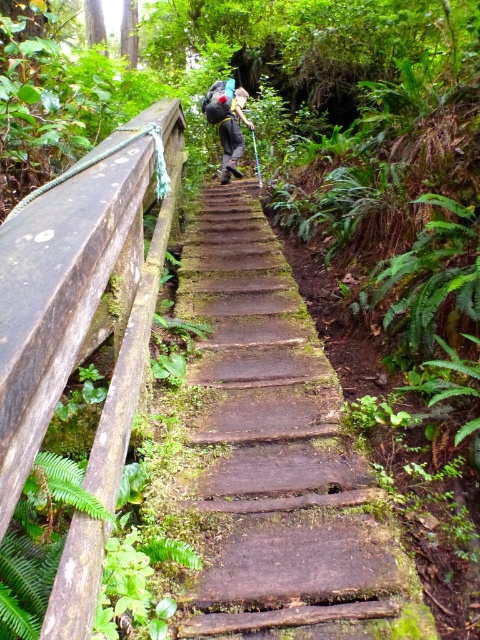
Question: Can you confirm if mossy wood stairs at center is positioned below brown weathered wood at left?

Choices:
 (A) yes
 (B) no

Answer: (A)

Question: Does mossy wood stairs at center have a larger size compared to brown weathered wood at left?

Choices:
 (A) yes
 (B) no

Answer: (A)

Question: Which point is closer to the camera?

Choices:
 (A) (225, 84)
 (B) (276, 397)

Answer: (B)

Question: Among these objects, which one is nearest to the camera?

Choices:
 (A) matte black backpack at center
 (B) mossy wood stairs at center
 (C) brown weathered wood at left

Answer: (C)

Question: Is brown weathered wood at left below matte black backpack at center?

Choices:
 (A) no
 (B) yes

Answer: (B)

Question: Which of the following is the farthest from the observer?

Choices:
 (A) (32, 440)
 (B) (240, 112)
 (C) (377, 588)

Answer: (B)